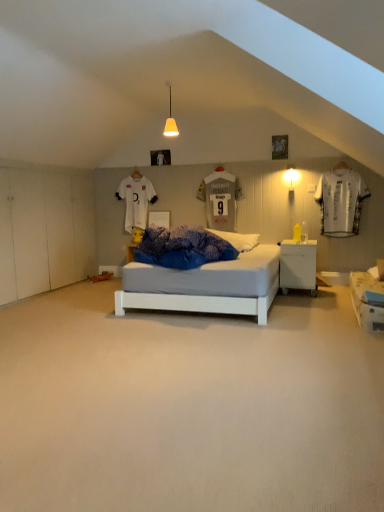
Question: Would you say white jersey at right is outside matte yellow cone at upper center?

Choices:
 (A) no
 (B) yes

Answer: (B)

Question: Is white jersey at right positioned with its back to matte yellow cone at upper center?

Choices:
 (A) no
 (B) yes

Answer: (A)

Question: From the image's perspective, is white jersey at right over matte yellow cone at upper center?

Choices:
 (A) no
 (B) yes

Answer: (A)

Question: Is white jersey at right further to camera compared to matte yellow cone at upper center?

Choices:
 (A) yes
 (B) no

Answer: (A)

Question: Does white jersey at right touch matte yellow cone at upper center?

Choices:
 (A) no
 (B) yes

Answer: (A)

Question: Would you say white jersey at right contains matte yellow cone at upper center?

Choices:
 (A) yes
 (B) no

Answer: (B)

Question: Are white glossy nightstand at center and white carpet at center far apart?

Choices:
 (A) yes
 (B) no

Answer: (A)

Question: Is white glossy nightstand at center wider than white carpet at center?

Choices:
 (A) no
 (B) yes

Answer: (A)

Question: Can you confirm if white glossy nightstand at center is taller than white carpet at center?

Choices:
 (A) yes
 (B) no

Answer: (A)

Question: Is white glossy nightstand at center positioned with its back to white carpet at center?

Choices:
 (A) no
 (B) yes

Answer: (A)

Question: Can you confirm if white glossy nightstand at center is shorter than white carpet at center?

Choices:
 (A) no
 (B) yes

Answer: (A)

Question: From a real-world perspective, is white glossy nightstand at center located higher than white carpet at center?

Choices:
 (A) yes
 (B) no

Answer: (A)

Question: Can we say matte yellow cone at upper center lies outside white jersey at right?

Choices:
 (A) no
 (B) yes

Answer: (B)